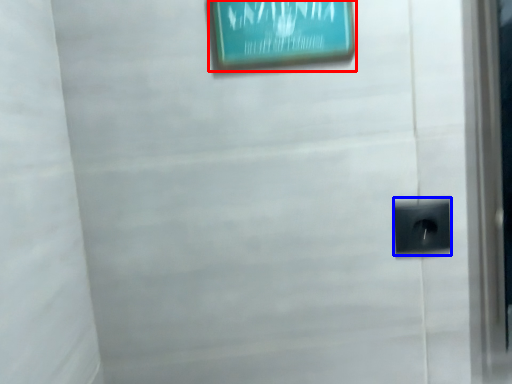
Question: Which object is closer to the camera taking this photo, picture frame (highlighted by a red box) or electric outlet (highlighted by a blue box)?

Choices:
 (A) picture frame
 (B) electric outlet

Answer: (A)